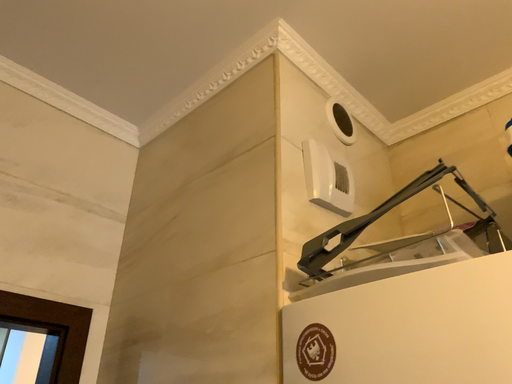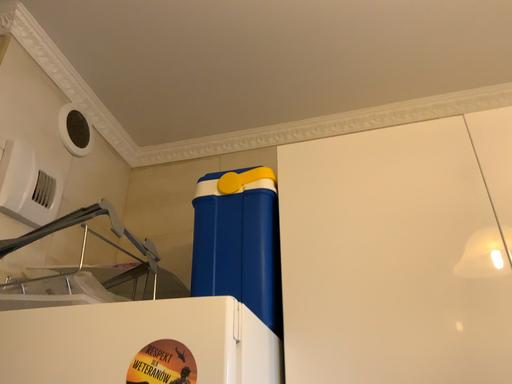
Question: How did the camera likely rotate when shooting the video?

Choices:
 (A) rotated left
 (B) rotated right

Answer: (B)